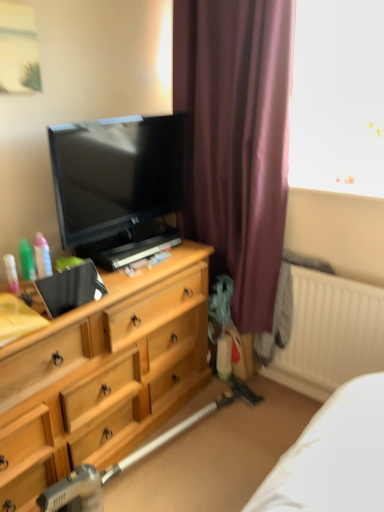
Question: Considering the relative positions of purple fabric curtain at center and translucent plastic spray bottle at left, which is counted as the 1th toiletry, starting from the left, in the image provided, is purple fabric curtain at center to the left or to the right of translucent plastic spray bottle at left, which is counted as the 1th toiletry, starting from the left,?

Choices:
 (A) left
 (B) right

Answer: (B)

Question: Based on their sizes in the image, would you say purple fabric curtain at center is bigger or smaller than translucent plastic spray bottle at left, the 3th toiletry when ordered from right to left?

Choices:
 (A) big
 (B) small

Answer: (A)

Question: Which object is the farthest from the matte black tv at left?

Choices:
 (A) white ribbed radiator at right
 (B) translucent plastic bottles at left, arranged as the 3th toiletry when viewed from the left
 (C) metallic silver vacuum cleaner at lower center
 (D) purple fabric curtain at center
 (E) wooden chest of drawers at left

Answer: (C)

Question: Which object is positioned closest to the metallic silver vacuum cleaner at lower center?

Choices:
 (A) white ribbed radiator at right
 (B) wooden chest of drawers at left
 (C) translucent plastic bottles at left, the first toiletry from the right
 (D) translucent plastic spray bottle at left, the 3th toiletry when ordered from right to left
 (E) purple fabric curtain at center

Answer: (B)